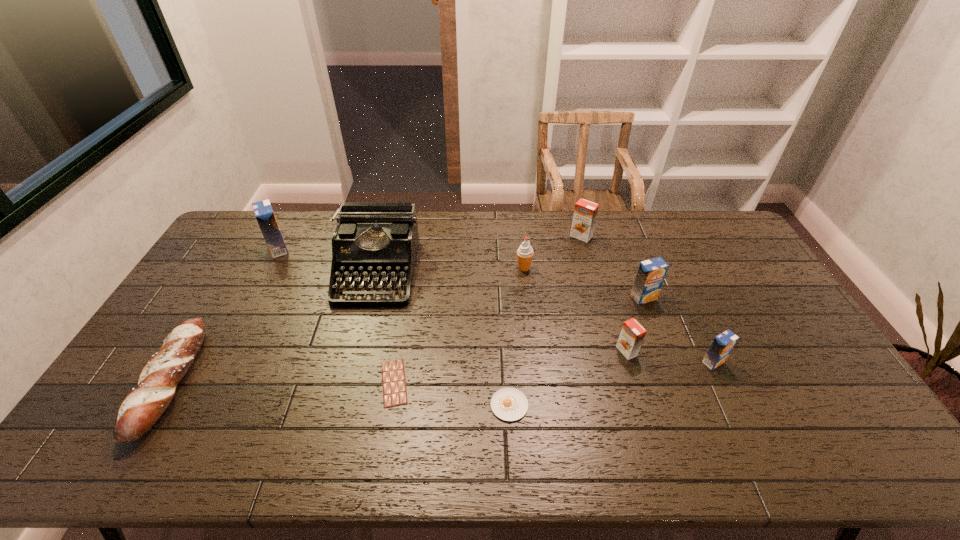
This screenshot has height=540, width=960. What are the coordinates of `vacant space located 0.110m on the back of the rightmost object` in the screenshot? It's located at (696, 325).

Where is `free space located on the back of the smaller orange orange juice`? free space located on the back of the smaller orange orange juice is located at coordinates (614, 310).

Locate an element on the screen. The image size is (960, 540). free space located 0.120m on the right of the leftmost object is located at coordinates (236, 381).

Where is `free space located on the back of the egg yolk`? free space located on the back of the egg yolk is located at coordinates (504, 309).

You are a GUI agent. You are given a task and a screenshot of the screen. Output one action in this format:
    pyautogui.click(x=<x>, y=<y>)
    Task: Click on the vacant space located on the left of the chocolate bar
    Image resolution: width=960 pixels, height=540 pixels.
    Given the screenshot: What is the action you would take?
    pyautogui.click(x=337, y=383)

Locate an element on the screen. typewriter that is at the far edge is located at coordinates (375, 241).

Find the location of a particular element. object at the near edge is located at coordinates (140, 410).

Image resolution: width=960 pixels, height=540 pixels. Find the location of `object located in the left edge section of the desktop`. object located in the left edge section of the desktop is located at coordinates (140, 410).

You are a GUI agent. You are given a task and a screenshot of the screen. Output one action in this format:
    pyautogui.click(x=<x>, y=<y>)
    Task: Click on the object at the near left corner
    The image size is (960, 540).
    Given the screenshot: What is the action you would take?
    pyautogui.click(x=140, y=410)

At what (x,y) coordinates should I click in order to perform the action: click on free space at the far edge of the desktop. Please return your answer as a coordinate pair (x, y). The height and width of the screenshot is (540, 960). Looking at the image, I should click on (609, 247).